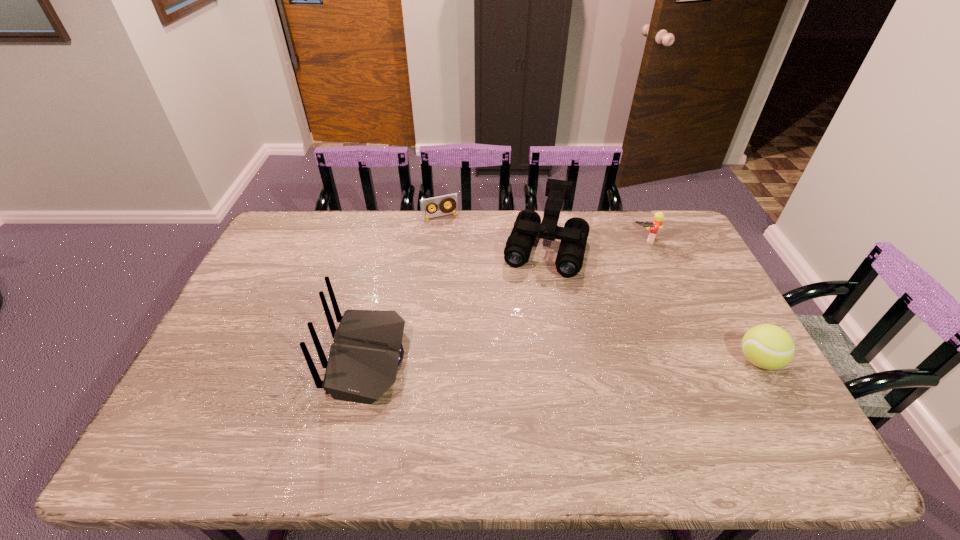
The width and height of the screenshot is (960, 540). What are the coordinates of `empty space that is in between the router and the second object from right to left` in the screenshot? It's located at tap(506, 299).

Find the location of a particular element. Image resolution: width=960 pixels, height=540 pixels. free point between the third object from right to left and the tennis ball is located at coordinates (652, 305).

Select which object appears as the fourth closest to the tennis ball. Please provide its 2D coordinates. Your answer should be formatted as a tuple, i.e. [(x, y)], where the tuple contains the x and y coordinates of a point satisfying the conditions above.

[(452, 199)]

Choose which object is the fourth nearest neighbor to the Lego. Please provide its 2D coordinates. Your answer should be formatted as a tuple, i.e. [(x, y)], where the tuple contains the x and y coordinates of a point satisfying the conditions above.

[(367, 349)]

Where is `free location that satisfies the following two spatial constraints: 1. on the front side of the binoculars; 2. on the left side of the shortest object`? free location that satisfies the following two spatial constraints: 1. on the front side of the binoculars; 2. on the left side of the shortest object is located at coordinates (x=437, y=249).